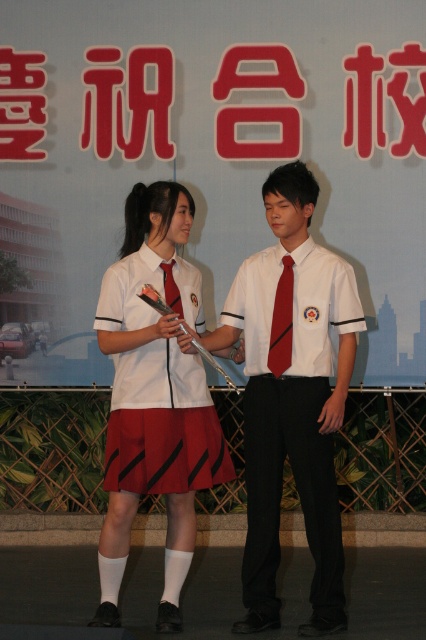
Is matte white shirt at center thinner than matte red tie at center?

In fact, matte white shirt at center might be wider than matte red tie at center.

Is matte white shirt at center above matte red tie at center?

No, matte white shirt at center is not above matte red tie at center.

This screenshot has height=640, width=426. Describe the element at coordinates (291, 412) in the screenshot. I see `matte white shirt at center` at that location.

The height and width of the screenshot is (640, 426). In order to click on matte white shirt at center in this screenshot , I will do pos(291,412).

Is matte white blouse at center positioned in front of red plastic sign at upper center?

Yes.

Does matte white blouse at center appear on the right side of red plastic sign at upper center?

Yes, matte white blouse at center is to the right of red plastic sign at upper center.

Between point (147, 348) and point (115, 104), which one is positioned in front?

Positioned in front is point (147, 348).

Locate an element on the screen. The image size is (426, 640). matte white blouse at center is located at coordinates (154, 397).

Who is lower down, matte white blouse at center or red satin tie at center?

Positioned lower is matte white blouse at center.

Can you confirm if matte white blouse at center is positioned to the right of red satin tie at center?

Incorrect, matte white blouse at center is not on the right side of red satin tie at center.

Which is behind, point (178, 321) or point (282, 346)?

Positioned behind is point (282, 346).

Where is `matte white blouse at center`? The width and height of the screenshot is (426, 640). matte white blouse at center is located at coordinates point(154,397).